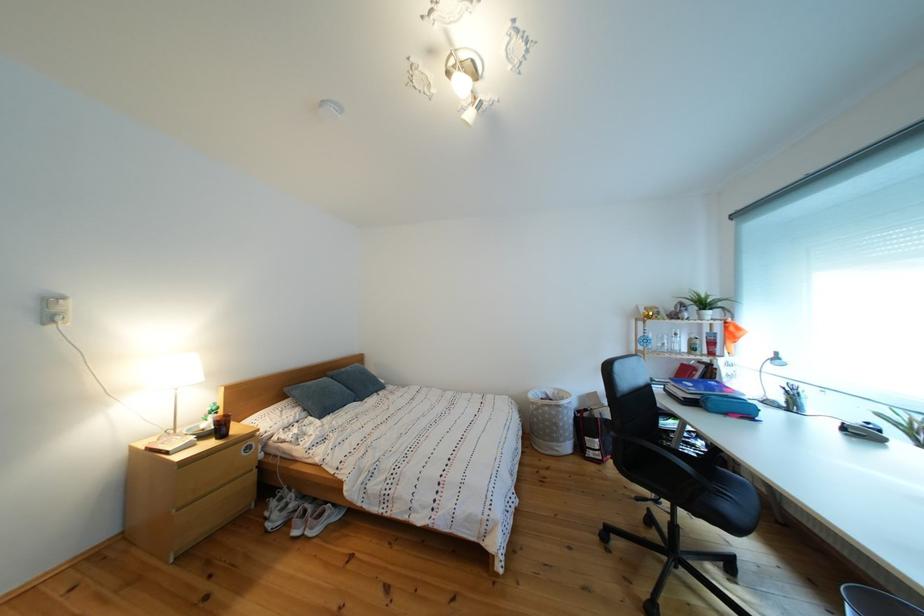
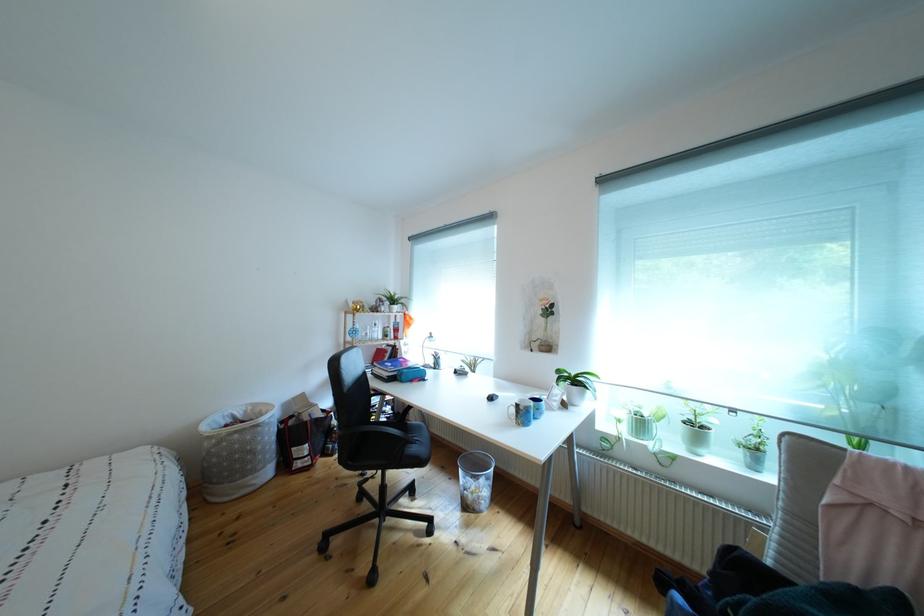
Find the pixel in the second image that matches point (567, 430) in the first image.

(263, 456)